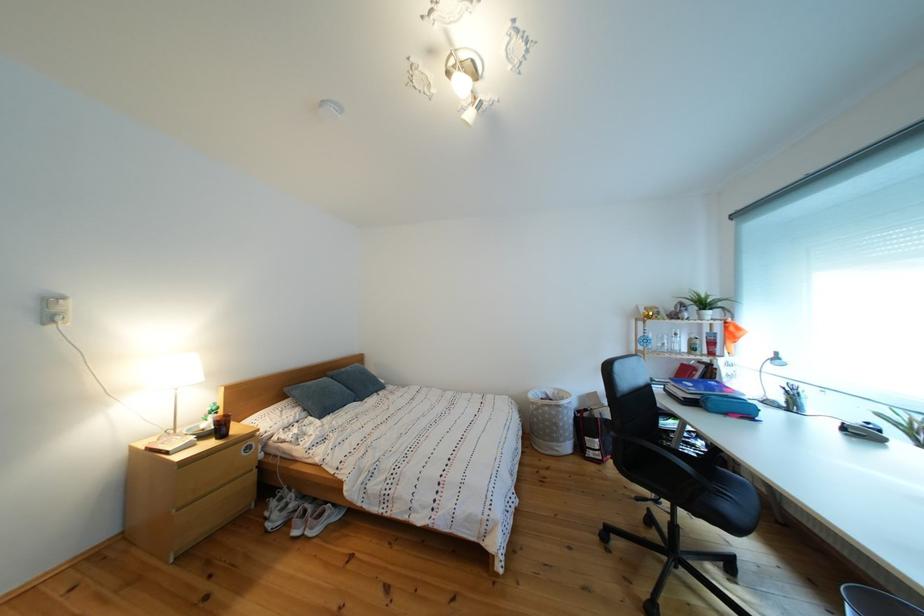
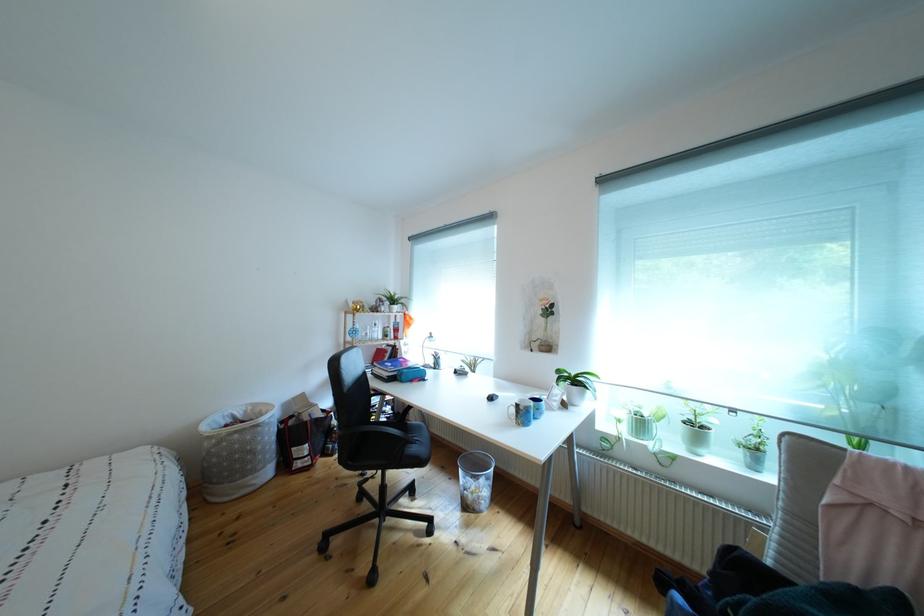
Find the pixel in the second image that matches point (567, 430) in the first image.

(263, 456)